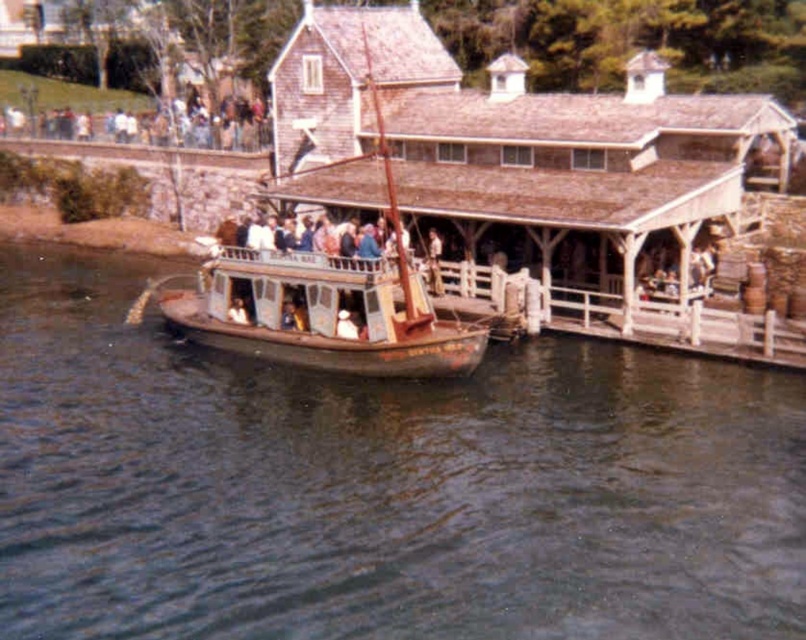
The width and height of the screenshot is (806, 640). Describe the element at coordinates (379, 486) in the screenshot. I see `brown water at lower center` at that location.

Can you confirm if brown water at lower center is positioned below rusty wooden boat at center?

Correct, brown water at lower center is located below rusty wooden boat at center.

Is point (491, 568) closer to viewer compared to point (370, 301)?

Yes, it is in front of point (370, 301).

At what (x,y) coordinates should I click in order to perform the action: click on brown water at lower center. Please return your answer as a coordinate pair (x, y). Looking at the image, I should click on (379, 486).